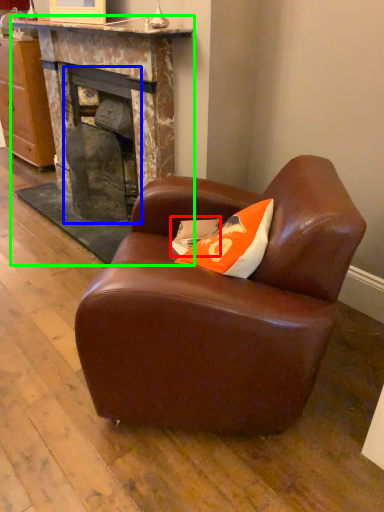
Question: Which object is the farthest from pillow (highlighted by a red box)? Choose among these: fireplace (highlighted by a blue box) or fireplace (highlighted by a green box).

Choices:
 (A) fireplace
 (B) fireplace

Answer: (B)